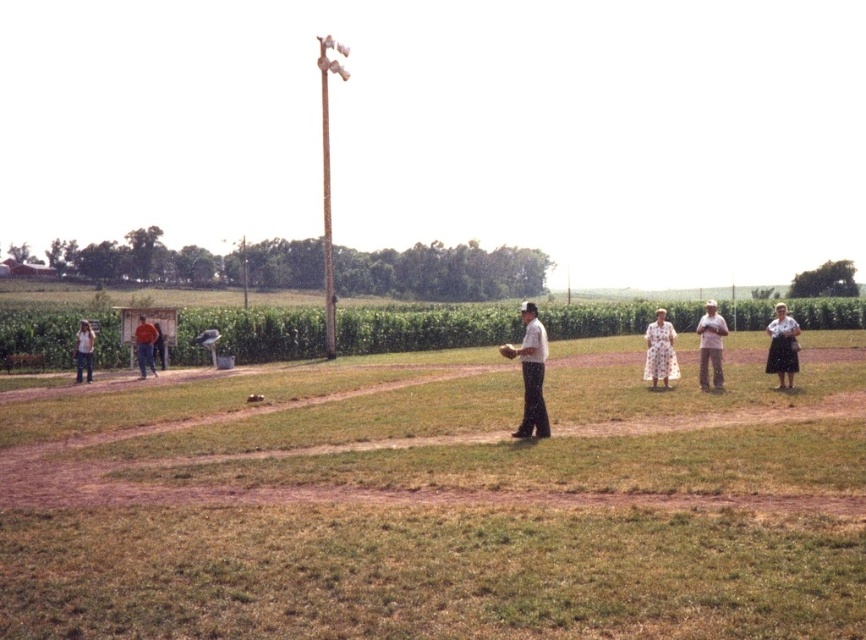
You are a photographer positioned at the edge of the baseball field. You need to capture a photo where both the white cotton dress at center and the brown leather glove at center are visible. Based on their sizes, which object will appear larger in the photo?

The white cotton dress at center is taller than the brown leather glove at center, so it will appear larger in the photo.

You are standing on the baseball field and see two points marked in the image. Which point is closer to you, point (157,328) or point (512,353)?

Point (157,328) is closer to you because it is further to the viewer than point (512,353).

You are organizing a charity event and need to place a large poster on a wall. The poster must be placed either on the white cotton dress at center or the brown leather glove at center. Which object can the poster be placed on based on their sizes?

The white cotton dress at center has a larger width than the brown leather glove at center, so the poster can be placed on the white cotton dress at center.